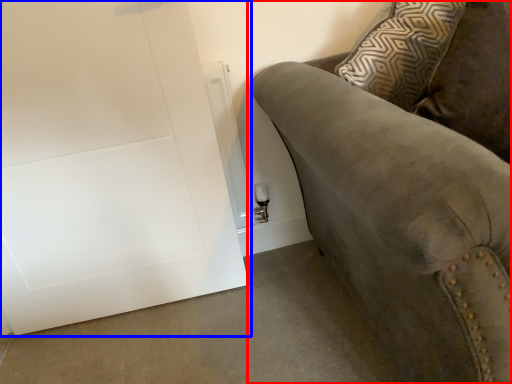
Question: Which object appears closest to the camera in this image, studio couch (highlighted by a red box) or door (highlighted by a blue box)?

Choices:
 (A) studio couch
 (B) door

Answer: (A)